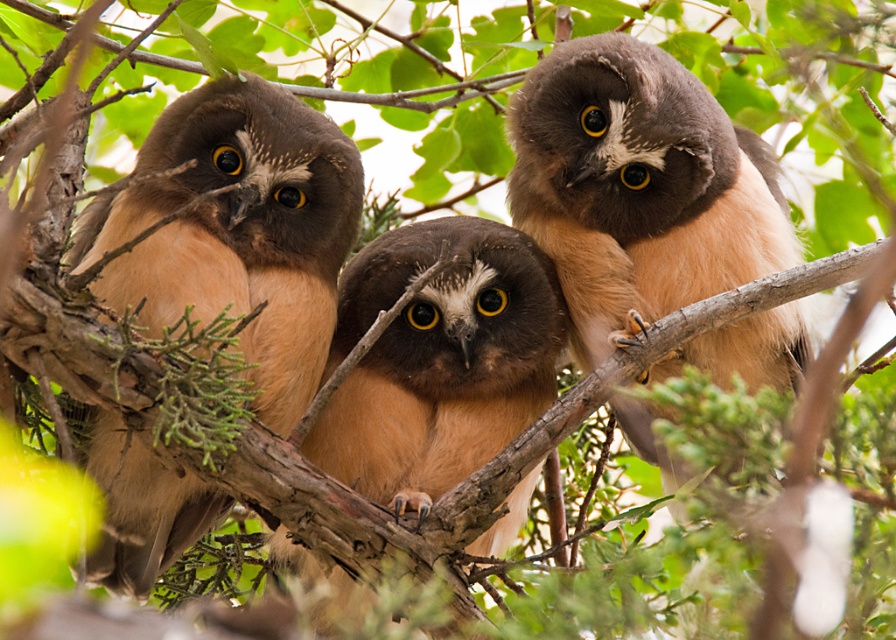
Question: Does brown fuzzy owl at left have a greater width compared to brown fluffy owl at upper right?

Choices:
 (A) no
 (B) yes

Answer: (A)

Question: Which point appears closest to the camera in this image?

Choices:
 (A) (618, 109)
 (B) (287, 404)
 (C) (452, 337)

Answer: (B)

Question: Does brown fuzzy owl at left appear under brown fluffy owl at center?

Choices:
 (A) yes
 (B) no

Answer: (B)

Question: Is brown fuzzy owl at left behind brown fluffy owl at center?

Choices:
 (A) yes
 (B) no

Answer: (B)

Question: Estimate the real-world distances between objects in this image. Which object is closer to the brown fluffy owl at upper right?

Choices:
 (A) brown fuzzy owl at left
 (B) brown fluffy owl at center

Answer: (B)

Question: Which object is closer to the camera taking this photo?

Choices:
 (A) brown fluffy owl at upper right
 (B) brown fuzzy owl at left

Answer: (B)